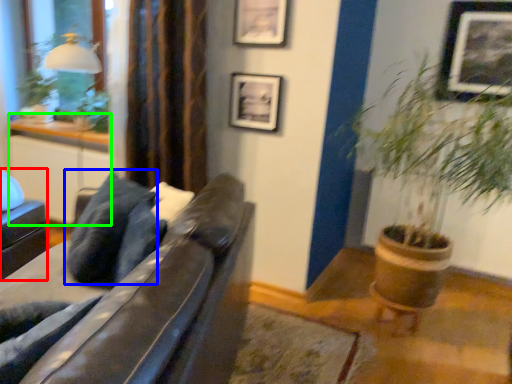
Question: Based on their relative distances, which object is nearer to swivel chair (highlighted by a red box)? Choose from pillow (highlighted by a blue box) and table (highlighted by a green box).

Choices:
 (A) pillow
 (B) table

Answer: (B)